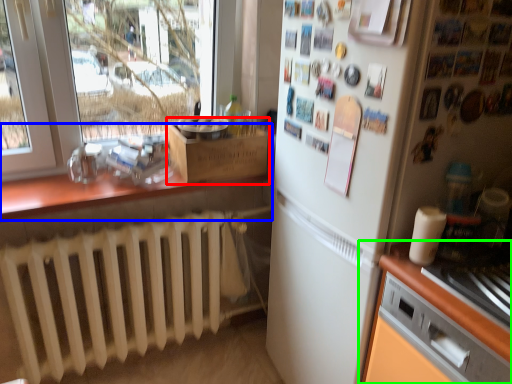
Question: Which object is positioned farthest from cardboard box (highlighted by a red box)? Select from countertop (highlighted by a blue box) and cabinetry (highlighted by a green box).

Choices:
 (A) countertop
 (B) cabinetry

Answer: (B)